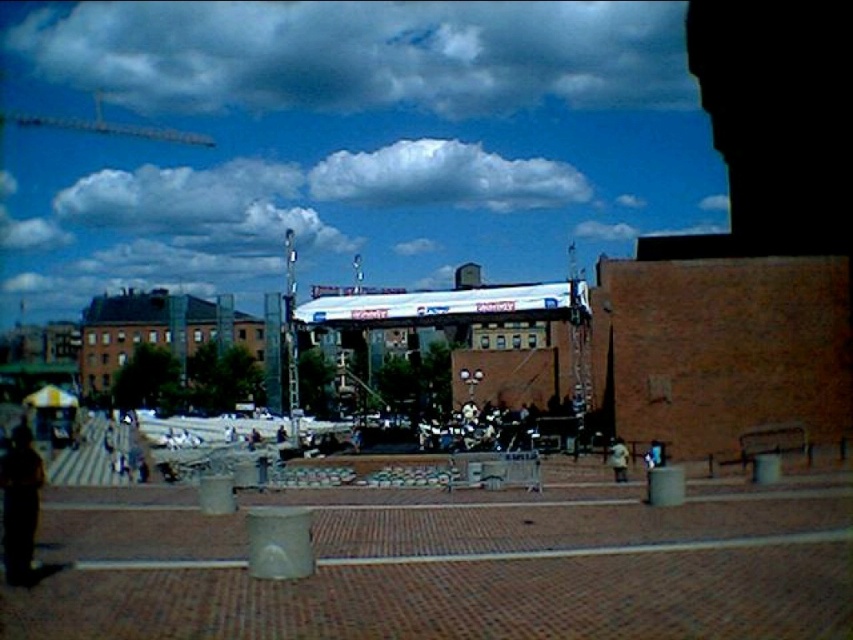
Question: Which object appears farthest from the camera in this image?

Choices:
 (A) light brown leather jacket at lower right
 (B) concrete at center
 (C) dark brown leather jacket at lower left

Answer: (A)

Question: Does concrete at center appear over light brown leather jacket at lower right?

Choices:
 (A) no
 (B) yes

Answer: (A)

Question: Does concrete at center have a larger size compared to light brown leather jacket at lower right?

Choices:
 (A) no
 (B) yes

Answer: (B)

Question: Which point is farther to the camera?

Choices:
 (A) (756, 618)
 (B) (624, 472)
 (C) (27, 566)

Answer: (B)

Question: Which point appears farthest from the camera in this image?

Choices:
 (A) (10, 465)
 (B) (70, 604)

Answer: (A)

Question: Does concrete at center have a larger size compared to dark brown leather jacket at lower left?

Choices:
 (A) yes
 (B) no

Answer: (B)